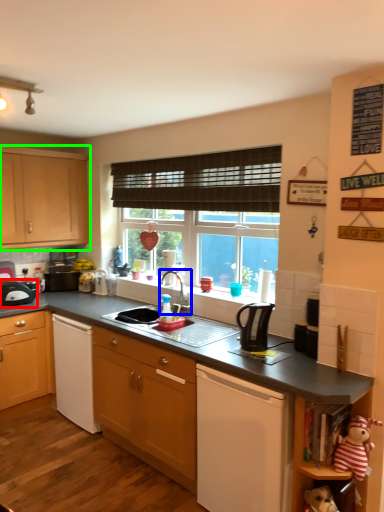
Question: Which is nearer to the kitchen appliance (highlighted by a red box)? tap (highlighted by a blue box) or cabinetry (highlighted by a green box).

Choices:
 (A) tap
 (B) cabinetry

Answer: (B)